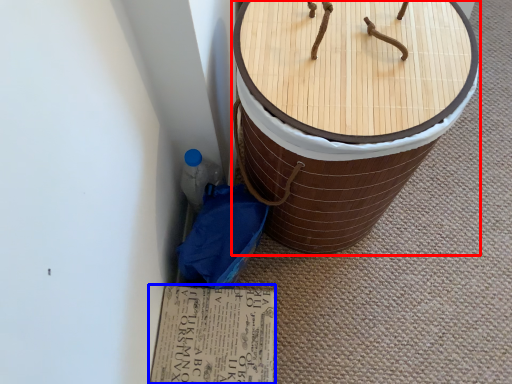
Question: Which of the following is the closest to the observer, furniture (highlighted by a red box) or cardboard (highlighted by a blue box)?

Choices:
 (A) furniture
 (B) cardboard

Answer: (A)